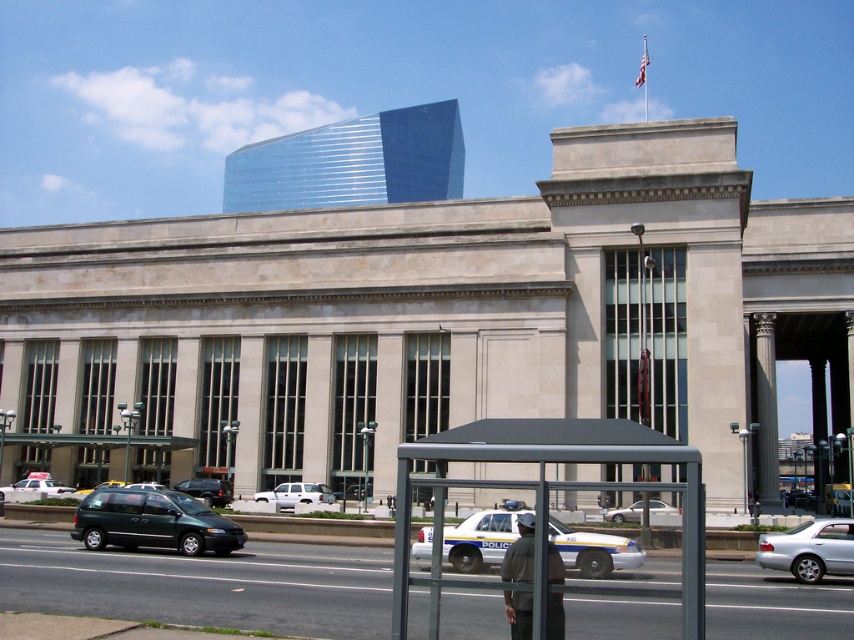
Question: From the image, what is the correct spatial relationship of white matte suv at center in relation to metallic silver taxi at center?

Choices:
 (A) right
 (B) left

Answer: (A)

Question: Can you confirm if white matte sedan at center is positioned to the left of metallic silver taxi at center?

Choices:
 (A) no
 (B) yes

Answer: (B)

Question: Can you confirm if green matte minivan at lower left is positioned below metallic gray suv at center-left?

Choices:
 (A) yes
 (B) no

Answer: (B)

Question: Which is nearer to the white glossy police car at center?

Choices:
 (A) silver metallic sedan at lower right
 (B) metallic gray suv at center-left
 (C) metallic gray bus stop at lower center
 (D) silver metallic sedan at center

Answer: (C)

Question: Which point is closer to the camera?

Choices:
 (A) metallic silver taxi at center
 (B) metallic gray suv at center-left

Answer: (A)

Question: Which object is positioned farthest from the silver metallic sedan at lower right?

Choices:
 (A) white glossy police car at center
 (B) white matte suv at center

Answer: (B)